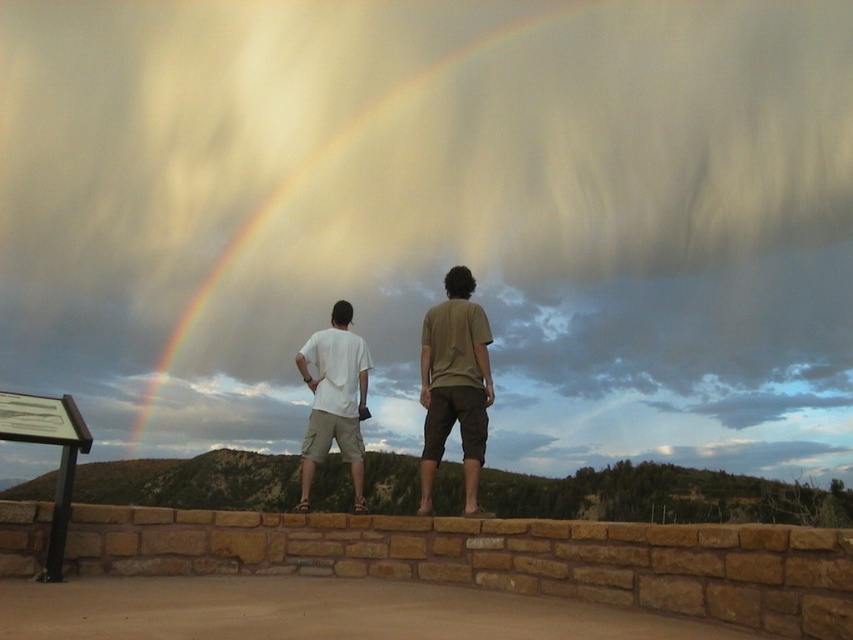
You are planning to place a small statue on the brown stone ledge at center so that it can be seen from below. Considering the rainbow at upper center, will the statue be visible from the base of the platform? Please explain your reasoning.

The brown stone ledge at center has a lesser height compared to rainbow at upper center. Since the rainbow is taller, the statue placed on the brown stone ledge at center might be partially obscured by the rainbow from the base of the platform. However, visibility could depend on the exact positioning and angles, but based on height alone, the statue may not be fully visible.